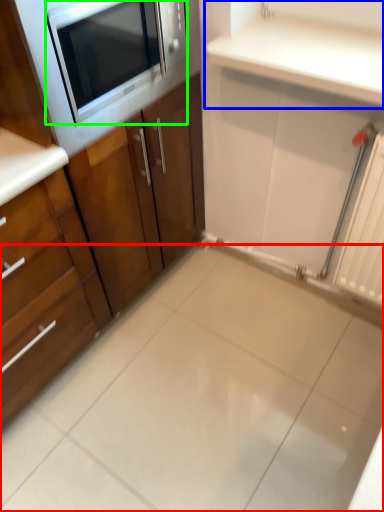
Question: Estimate the real-world distances between objects in this image. Which object is farther from ceramic tile (highlighted by a red box), countertop (highlighted by a blue box) or microwave oven (highlighted by a green box)?

Choices:
 (A) countertop
 (B) microwave oven

Answer: (B)